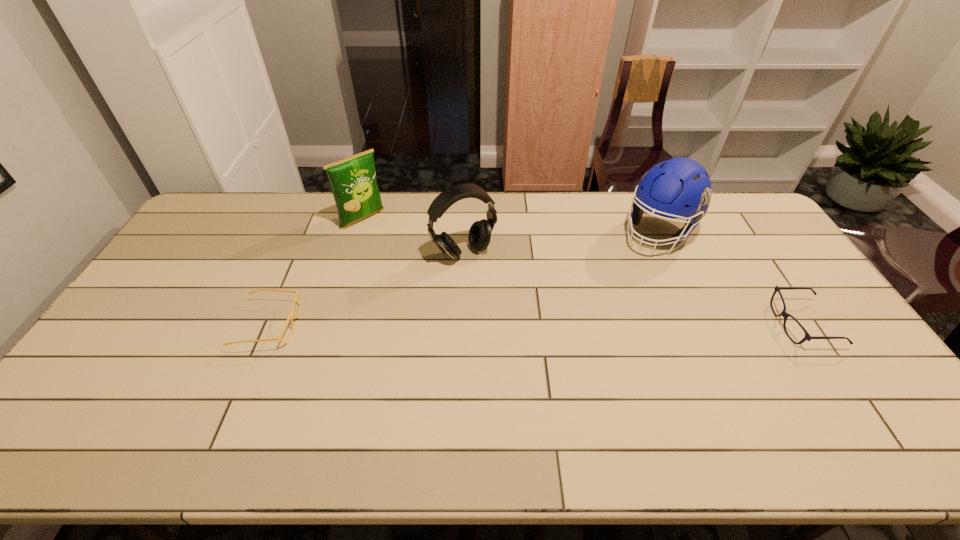
This screenshot has width=960, height=540. What are the coordinates of `free spot located on the ear cups of the third object from right to left` in the screenshot? It's located at (516, 318).

Where is `free spot located on the ear cups of the third object from right to left`? Image resolution: width=960 pixels, height=540 pixels. free spot located on the ear cups of the third object from right to left is located at coordinates (526, 333).

The image size is (960, 540). I want to click on vacant space situated on the front-facing side of the football helmet, so click(x=626, y=271).

Image resolution: width=960 pixels, height=540 pixels. I want to click on vacant space positioned on the front-facing side of the football helmet, so click(627, 269).

Where is `free location located on the front-facing side of the football helmet`? free location located on the front-facing side of the football helmet is located at coordinates (619, 278).

Where is `free space located 0.170m on the front-facing side of the crisp (potato chip)`? This screenshot has width=960, height=540. free space located 0.170m on the front-facing side of the crisp (potato chip) is located at coordinates (399, 252).

Identify the location of free space located 0.070m on the front-facing side of the crisp (potato chip). This screenshot has height=540, width=960. (384, 238).

In order to click on blank space located on the front-facing side of the crisp (potato chip) in this screenshot , I will do `click(420, 271)`.

Where is `football helmet present at the far edge`? The height and width of the screenshot is (540, 960). football helmet present at the far edge is located at coordinates (680, 187).

I want to click on crisp (potato chip) situated at the far edge, so click(353, 181).